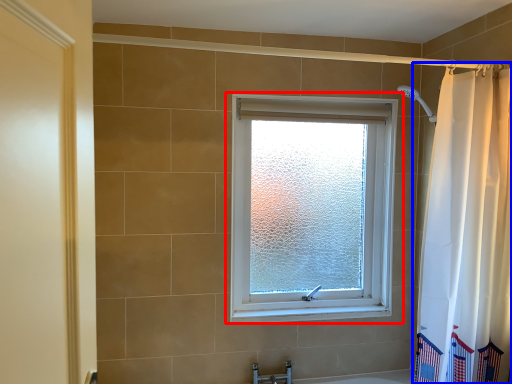
Question: Which object is closer to the camera taking this photo, window (highlighted by a red box) or curtain (highlighted by a blue box)?

Choices:
 (A) window
 (B) curtain

Answer: (B)